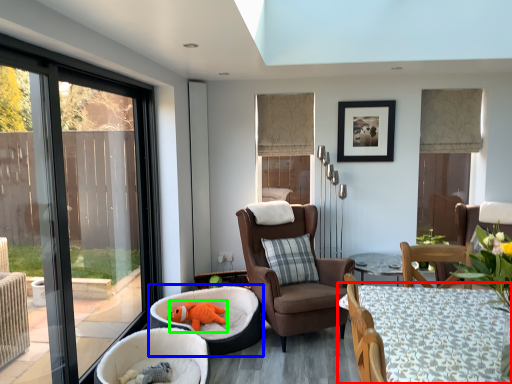
Question: Considering the real-world distances, which object is farthest from table (highlighted by a red box)? infant bed (highlighted by a blue box) or animal (highlighted by a green box)?

Choices:
 (A) infant bed
 (B) animal

Answer: (B)